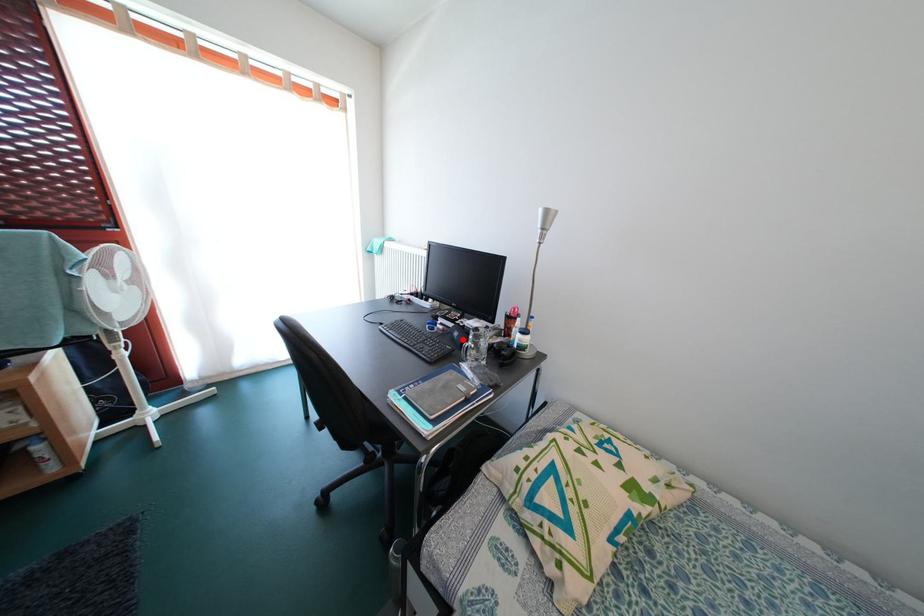
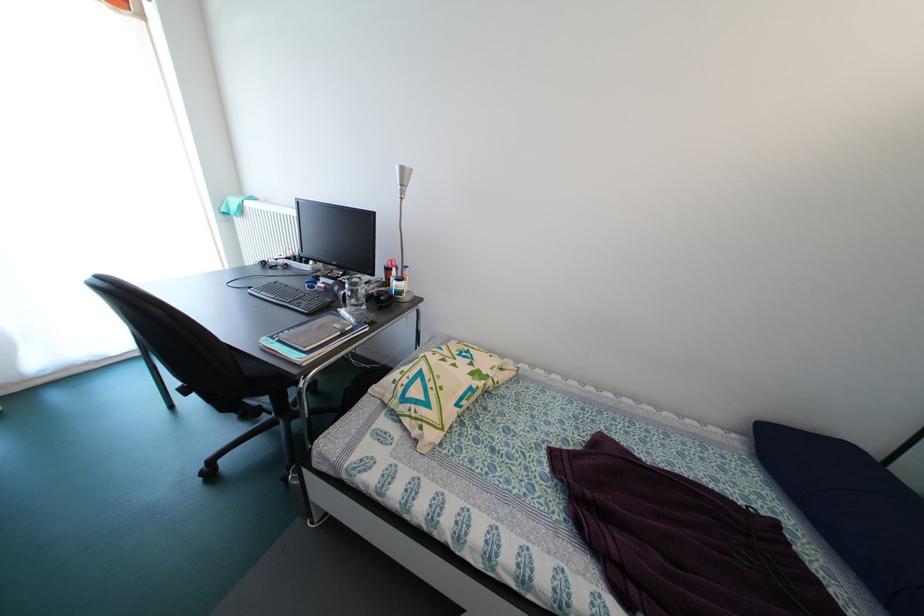
Find the pixel in the second image that matches the highlighted location in the first image.

(344, 294)